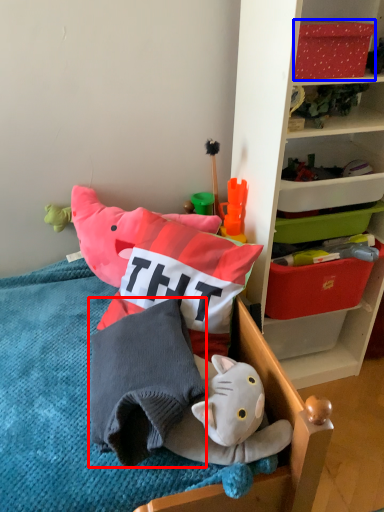
Question: Among these objects, which one is nearest to the camera, pillow (highlighted by a red box) or storage box (highlighted by a blue box)?

Choices:
 (A) pillow
 (B) storage box

Answer: (A)